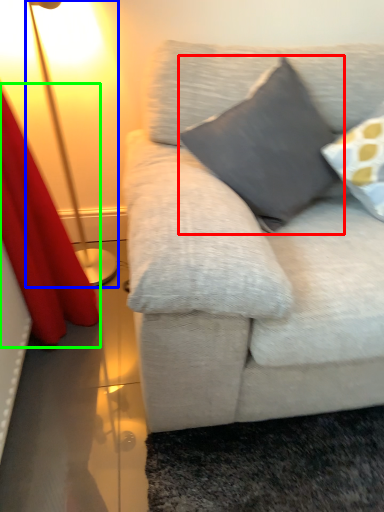
Question: Estimate the real-world distances between objects in this image. Which object is closer to pillow (highlighted by a red box), lamp (highlighted by a blue box) or curtain (highlighted by a green box)?

Choices:
 (A) lamp
 (B) curtain

Answer: (B)